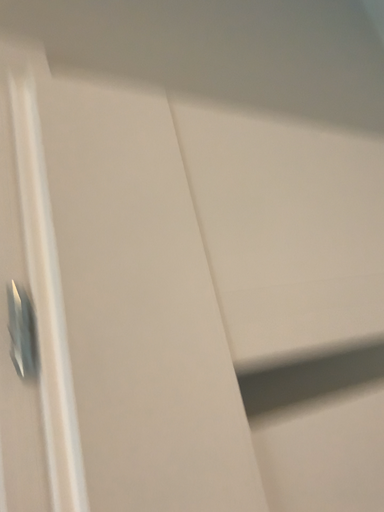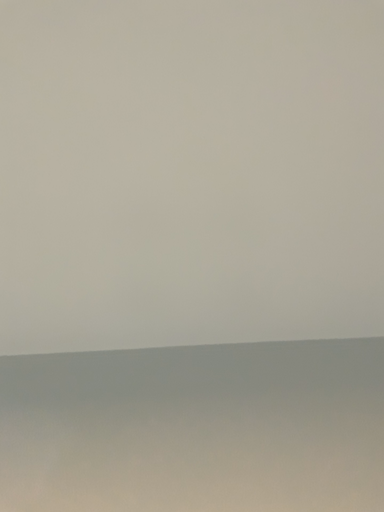
Question: How did the camera likely rotate when shooting the video?

Choices:
 (A) rotated left
 (B) rotated right

Answer: (A)